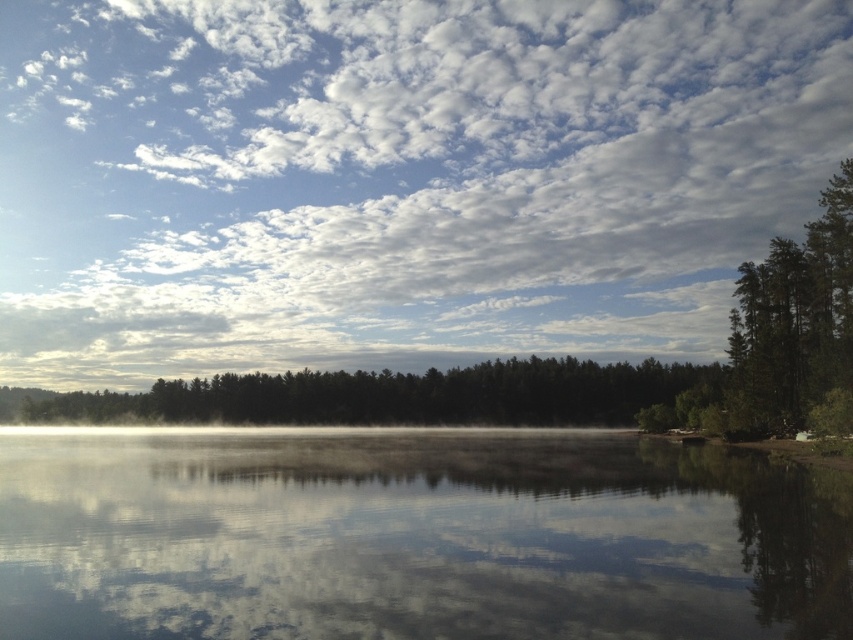
Is green matte forest at center closer to camera compared to green textured tree at right?

That is False.

Measure the distance between green matte forest at center and camera.

A distance of 110.39 meters exists between green matte forest at center and camera.

I want to click on green matte forest at center, so click(x=390, y=396).

Is point (178, 566) positioned after point (733, 349)?

No, it is not.

Can you confirm if transparent water at center is shorter than green textured tree at right?

Correct, transparent water at center is not as tall as green textured tree at right.

In order to click on transparent water at center in this screenshot , I will do `click(413, 538)`.

Is point (517, 627) closer to camera compared to point (434, 372)?

That is True.

This screenshot has width=853, height=640. Find the location of `transparent water at center`. transparent water at center is located at coordinates (413, 538).